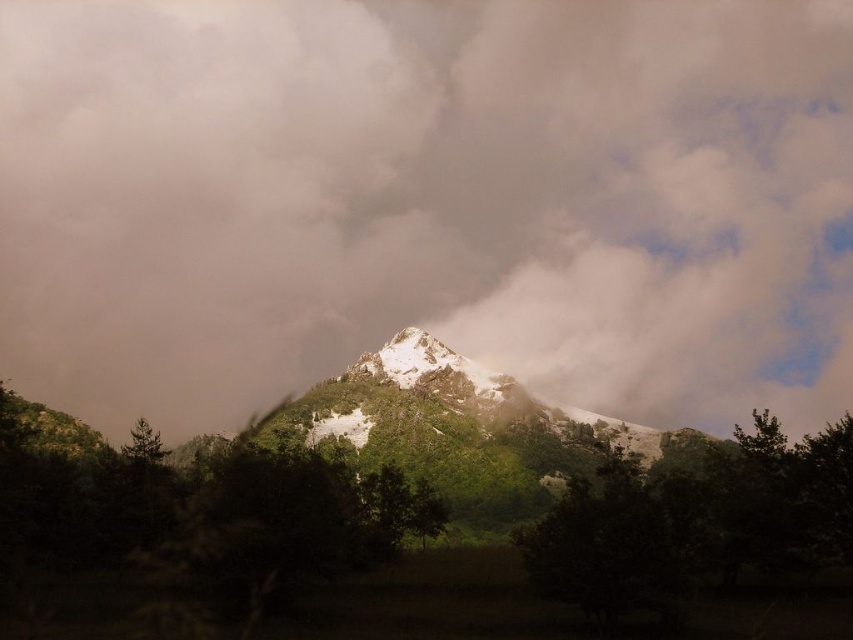
Question: Does white fluffy cloud at center have a larger size compared to green leafy tree at center?

Choices:
 (A) no
 (B) yes

Answer: (B)

Question: Which object appears closest to the camera in this image?

Choices:
 (A) green leafy tree at center
 (B) white fluffy cloud at center

Answer: (A)

Question: Does white fluffy cloud at center appear on the left side of green leafy tree at center?

Choices:
 (A) no
 (B) yes

Answer: (B)

Question: Is white fluffy cloud at center closer to camera compared to green leafy tree at center?

Choices:
 (A) no
 (B) yes

Answer: (A)

Question: Which object is closer to the camera taking this photo?

Choices:
 (A) green leafy tree at center
 (B) white fluffy cloud at center

Answer: (A)

Question: Which point is farther to the camera?

Choices:
 (A) green leafy tree at center
 (B) white fluffy cloud at center

Answer: (B)